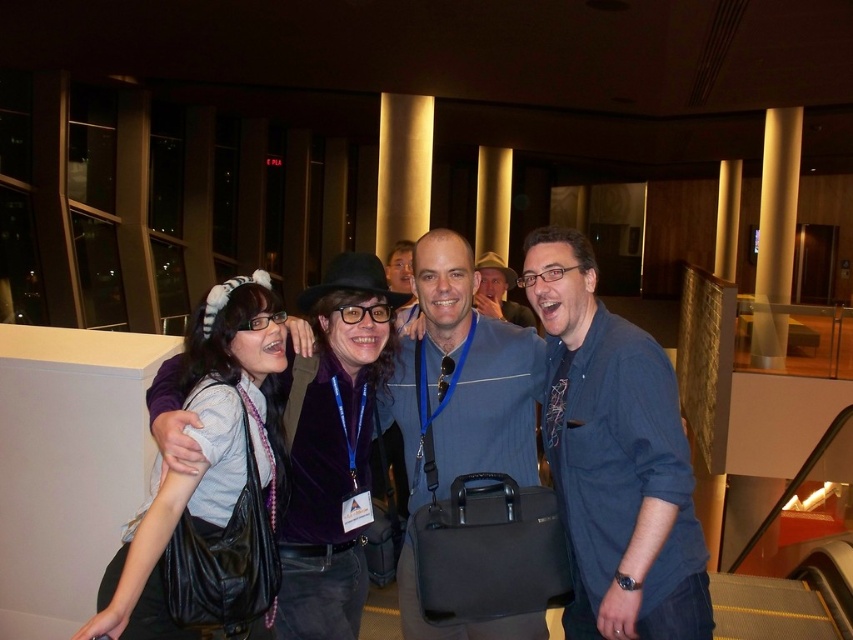
How much distance is there between blue fabric shirt at center and black leather bag at center?

25.96 inches

Between point (410, 445) and point (218, 516), which one is positioned in front?

Point (218, 516) is in front.

Find the location of a particular element. The height and width of the screenshot is (640, 853). blue fabric shirt at center is located at coordinates (460, 378).

Where is `blue cotton shirt at right`? This screenshot has height=640, width=853. blue cotton shirt at right is located at coordinates (614, 458).

Does blue cotton shirt at right have a greater height compared to black leather bag at center?

Correct, blue cotton shirt at right is much taller as black leather bag at center.

Find the location of a particular element. The image size is (853, 640). blue cotton shirt at right is located at coordinates (614, 458).

Is point (349, 268) positioned behind point (489, 305)?

No, it is not.

Is matte black purse at center above matte blue shirt at center?

No, matte black purse at center is not above matte blue shirt at center.

Between point (312, 348) and point (496, 262), which one is positioned in front?

Point (312, 348)

Identify the location of matte black purse at center. The width and height of the screenshot is (853, 640). (332, 444).